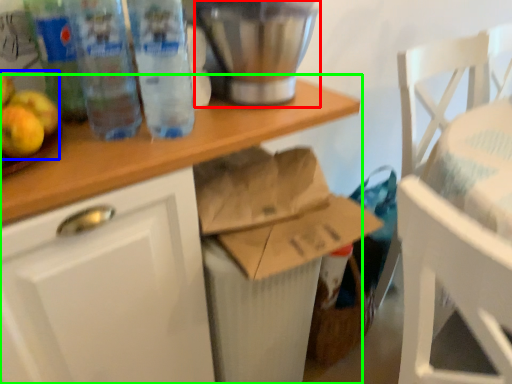
Question: Considering the real-world distances, which object is farthest from appliance (highlighted by a red box)? apple (highlighted by a blue box) or desk (highlighted by a green box)?

Choices:
 (A) apple
 (B) desk

Answer: (A)